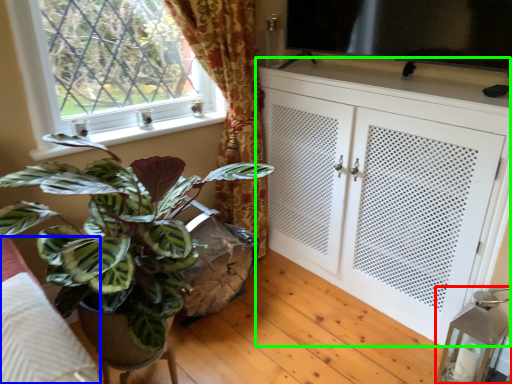
Question: Based on their relative distances, which object is nearer to lamp (highlighted by a red box)? Choose from bedding (highlighted by a blue box) and cabinetry (highlighted by a green box).

Choices:
 (A) bedding
 (B) cabinetry

Answer: (B)